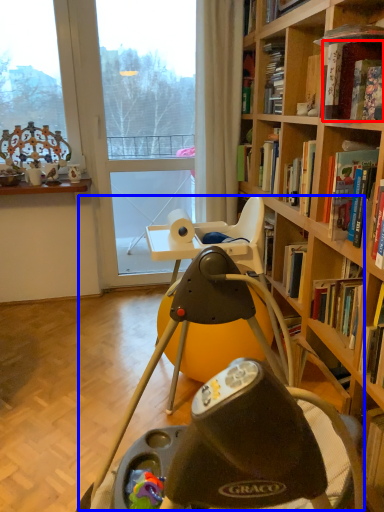
Question: Among these objects, which one is farthest to the camera, book (highlighted by a red box) or swivel chair (highlighted by a blue box)?

Choices:
 (A) book
 (B) swivel chair

Answer: (A)